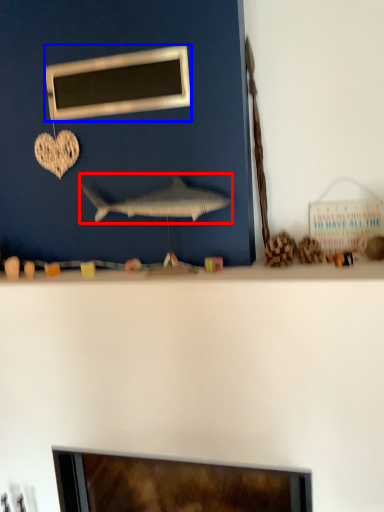
Question: Which of the following is the farthest to the observer, fish (highlighted by a red box) or picture frame (highlighted by a blue box)?

Choices:
 (A) fish
 (B) picture frame

Answer: (B)